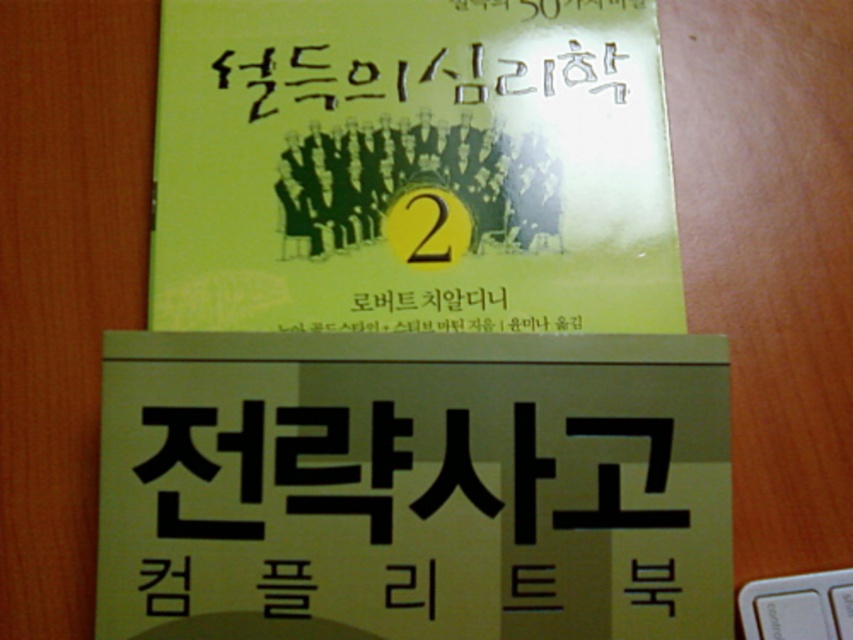
Who is more distant from viewer, (630, 241) or (274, 106)?

Positioned behind is point (274, 106).

Is green matte book at center bigger than black handwritten text at center?

Yes.

This screenshot has width=853, height=640. What do you see at coordinates (412, 168) in the screenshot?
I see `green matte book at center` at bounding box center [412, 168].

Identify the location of green matte book at center. (412, 168).

Is yellow paper sign at center to the right of black handwritten text at center from the viewer's perspective?

Incorrect, yellow paper sign at center is not on the right side of black handwritten text at center.

Locate an element on the screen. yellow paper sign at center is located at coordinates (413, 486).

This screenshot has width=853, height=640. I want to click on yellow paper sign at center, so click(413, 486).

Which is below, yellow paper sign at center or white plastic keyboard at lower right?

Positioned lower is white plastic keyboard at lower right.

Does yellow paper sign at center appear over white plastic keyboard at lower right?

A: Yes.

Which is in front, point (469, 490) or point (802, 605)?

Point (469, 490) is more forward.

Where is `yellow paper sign at center`? The height and width of the screenshot is (640, 853). yellow paper sign at center is located at coordinates (413, 486).